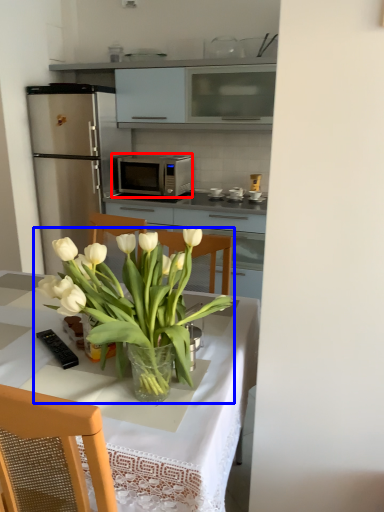
Question: Which of the following is the farthest to the observer, microwave oven (highlighted by a red box) or houseplant (highlighted by a blue box)?

Choices:
 (A) microwave oven
 (B) houseplant

Answer: (A)